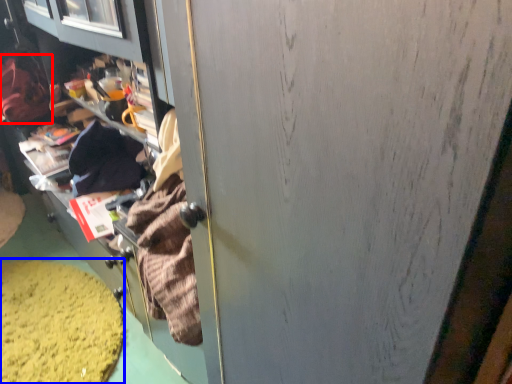
Question: Which object appears closest to the camera in this image, clothing (highlighted by a red box) or debris (highlighted by a blue box)?

Choices:
 (A) clothing
 (B) debris

Answer: (B)